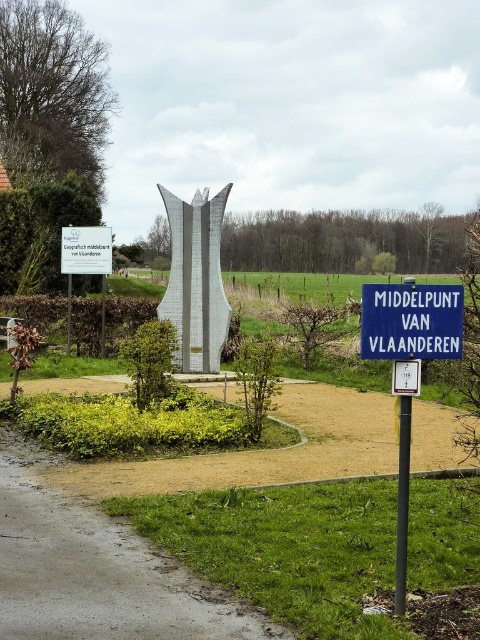
You are standing in the outdoor area and see the silver metallic sculpture at center and the white plastic parking sign at center. Which object is located above the other?

The white plastic parking sign at center is above the silver metallic sculpture at center because the silver metallic sculpture at center is positioned under it.

You are standing at the Geografisch middelpunt van Vlaanderen monument and notice two points marked on the ground. The first point is at coordinates point (170, 589) and the second is at point (200, 344). From your vantage point at the monument, which point is closer to you?

Point (170, 589) is in front of point (200, 344), so the first point is closer to you.